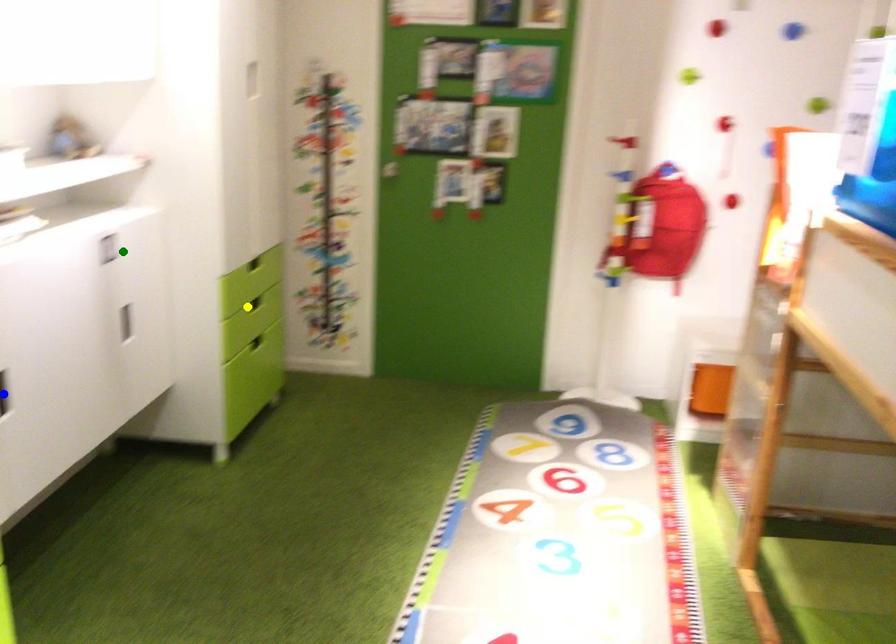
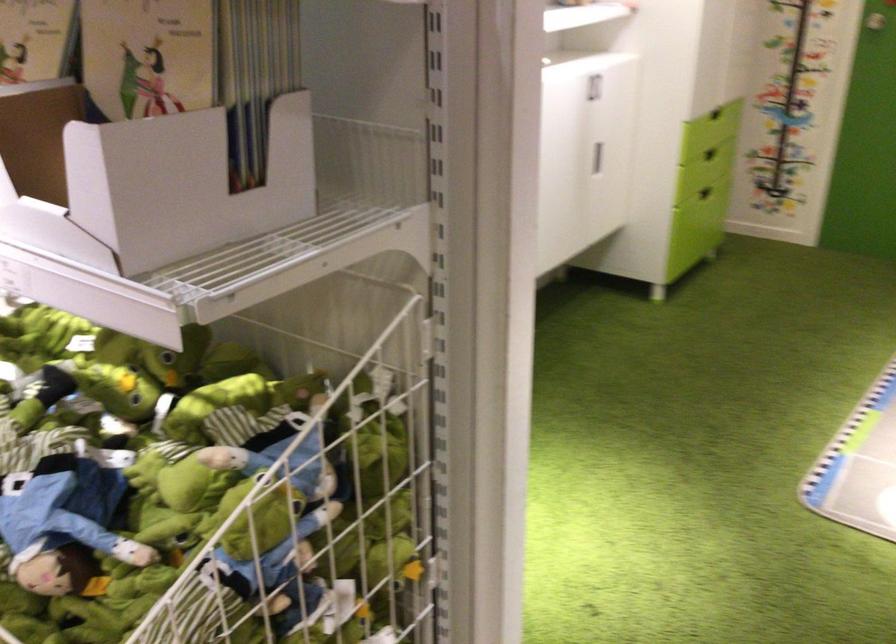
I am providing you with two images of the same scene from different viewpoints. Three points are marked in image1. Which point corresponds to a part or object that is occluded in image2?In image1, three points are marked. Which of them correspond to a part or object that is occluded in image2?Among the three points shown in image1, which one corresponds to a part or object that is no longer visible due to occlusion in image2?

blue point